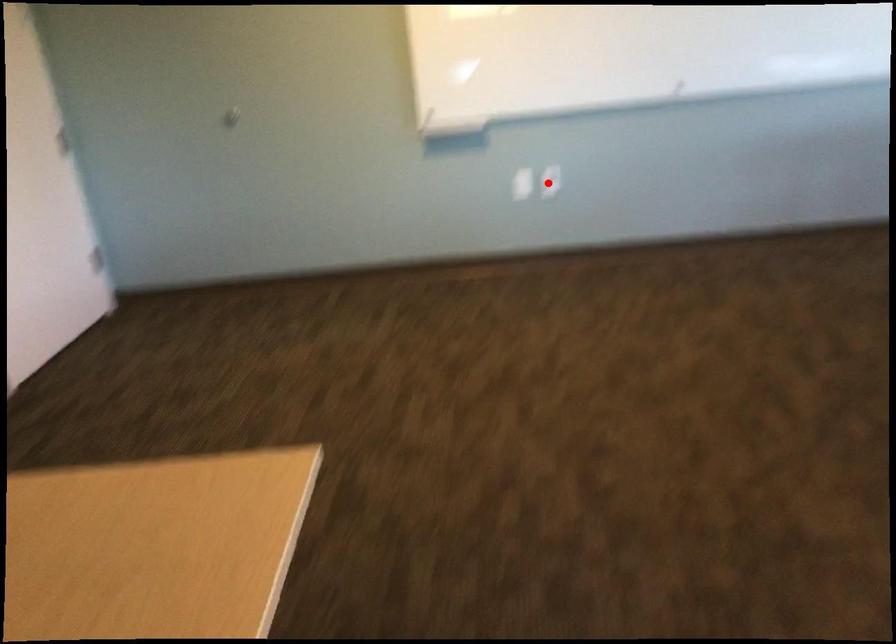
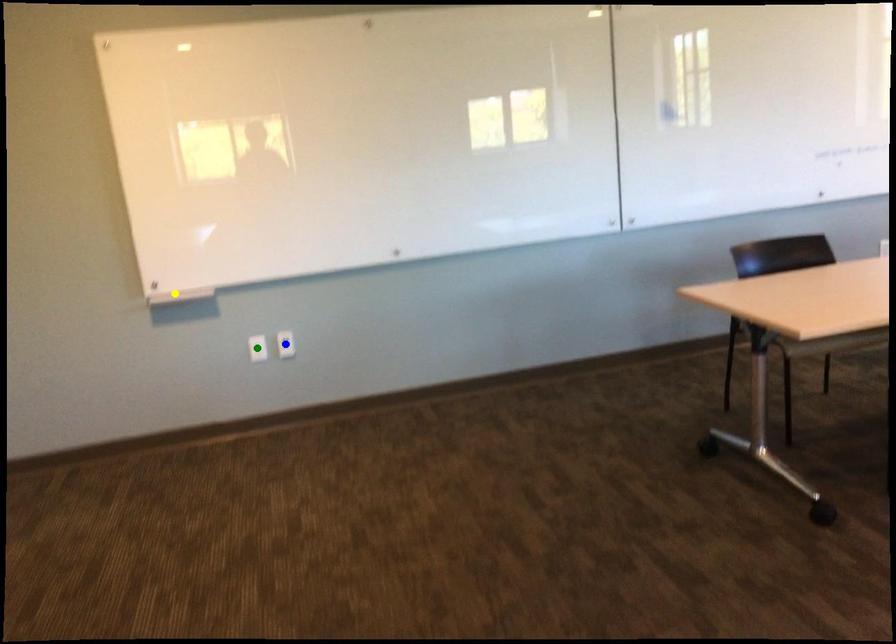
Question: I am providing you with two images of the same scene from different viewpoints. A red point is marked on the first image. You are given multiple points on the second image. Which point in image 2 is actually the same real-world point as the red point in image 1?

Choices:
 (A) green point
 (B) yellow point
 (C) blue point

Answer: (C)